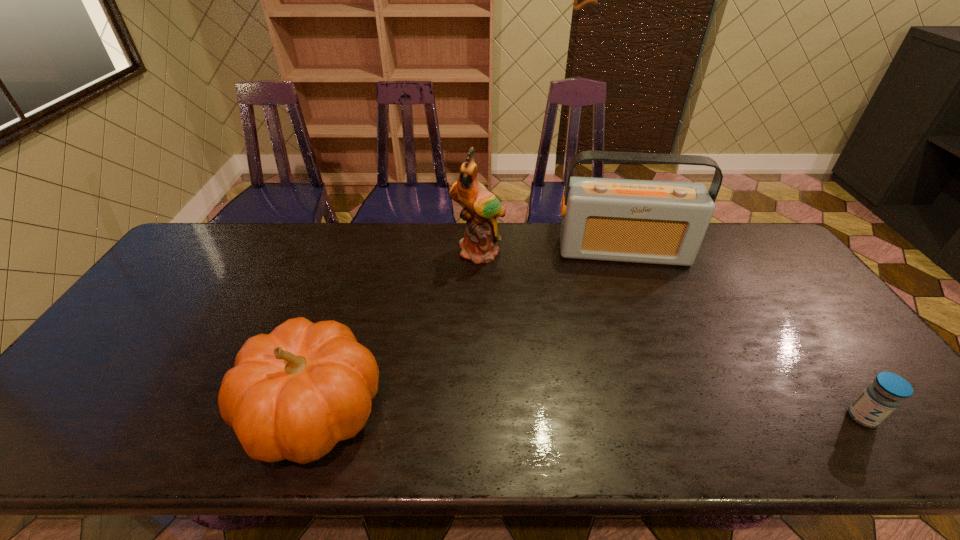
What are the coordinates of `pumpkin` in the screenshot? It's located at (293, 394).

Where is `the leftmost object`? The width and height of the screenshot is (960, 540). the leftmost object is located at coordinates (293, 394).

Identify the location of the rightmost object. (886, 393).

Identify the location of the shortest object. The image size is (960, 540). (886, 393).

At what (x,y) coordinates should I click in order to perform the action: click on parrot. Please return your answer as a coordinate pair (x, y). The height and width of the screenshot is (540, 960). Looking at the image, I should click on (482, 208).

Image resolution: width=960 pixels, height=540 pixels. In order to click on the third object from left to right in this screenshot , I will do `click(640, 221)`.

This screenshot has height=540, width=960. Identify the location of vacant space located on the left of the pumpkin. (166, 411).

At what (x,y) coordinates should I click in order to perform the action: click on vacant area situated on the back of the rightmost object. Please return your answer as a coordinate pair (x, y). This screenshot has height=540, width=960. Looking at the image, I should click on (773, 294).

Locate an element on the screen. vacant space located 0.320m on the front-facing side of the parrot is located at coordinates (506, 342).

Identify the location of free space located 0.130m on the front-facing side of the parrot. (492, 294).